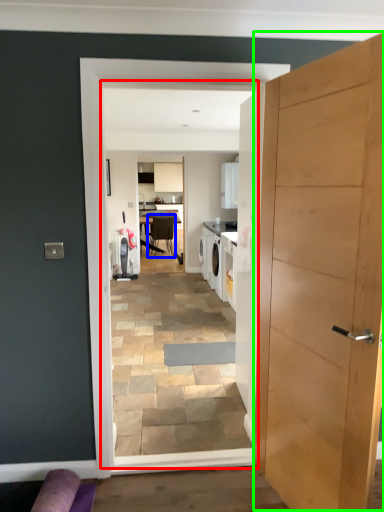
Question: Which object is positioned farthest from residence (highlighted by a red box)? Select from chair (highlighted by a blue box) and door (highlighted by a green box).

Choices:
 (A) chair
 (B) door

Answer: (A)